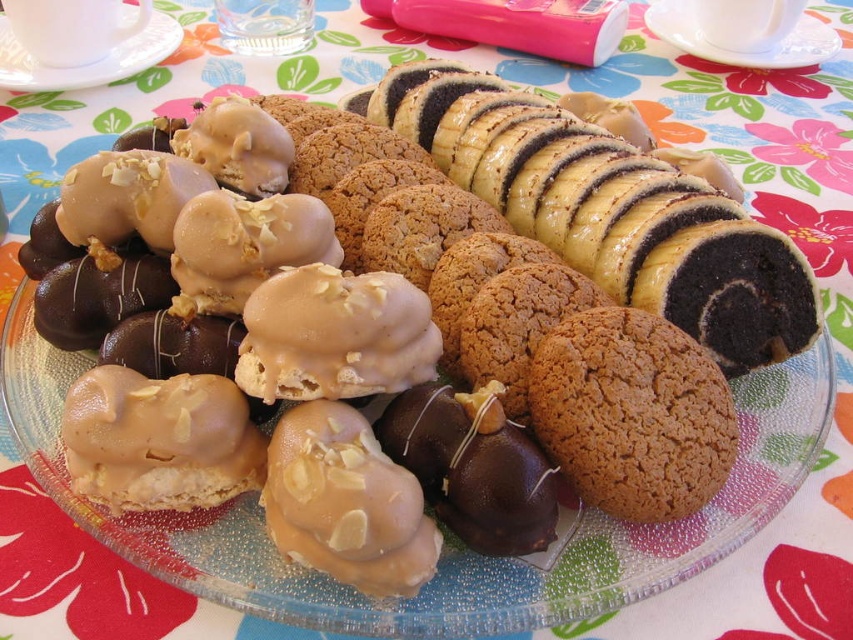
Is point (136, 429) closer to viewer compared to point (798, 45)?

Yes, point (136, 429) is in front of point (798, 45).

Between matte almond-coated pastry at center-left and white glossy plate at upper center, which one appears on the left side from the viewer's perspective?

Positioned to the left is matte almond-coated pastry at center-left.

Who is more forward, (119,406) or (730,3)?

Positioned in front is point (119,406).

Where is `matte almond-coated pastry at center-left`? This screenshot has height=640, width=853. matte almond-coated pastry at center-left is located at coordinates (160, 440).

Where is `chocolate-coated pastry at center`? This screenshot has height=640, width=853. chocolate-coated pastry at center is located at coordinates (610, 209).

Who is positioned more to the right, chocolate-coated pastry at center or matte caramel cookie at center?

From the viewer's perspective, chocolate-coated pastry at center appears more on the right side.

Between point (734, 179) and point (251, 317), which one is positioned in front?

Point (251, 317)

Identify the location of chocolate-coated pastry at center. (610, 209).

Can you confirm if matte almond-coated pastry at center-left is positioned above matte caramel almond at center?

Yes.

Who is more distant from viewer, (167, 456) or (375, 522)?

Point (167, 456)

Find the location of a particular element. The width and height of the screenshot is (853, 640). matte almond-coated pastry at center-left is located at coordinates (160, 440).